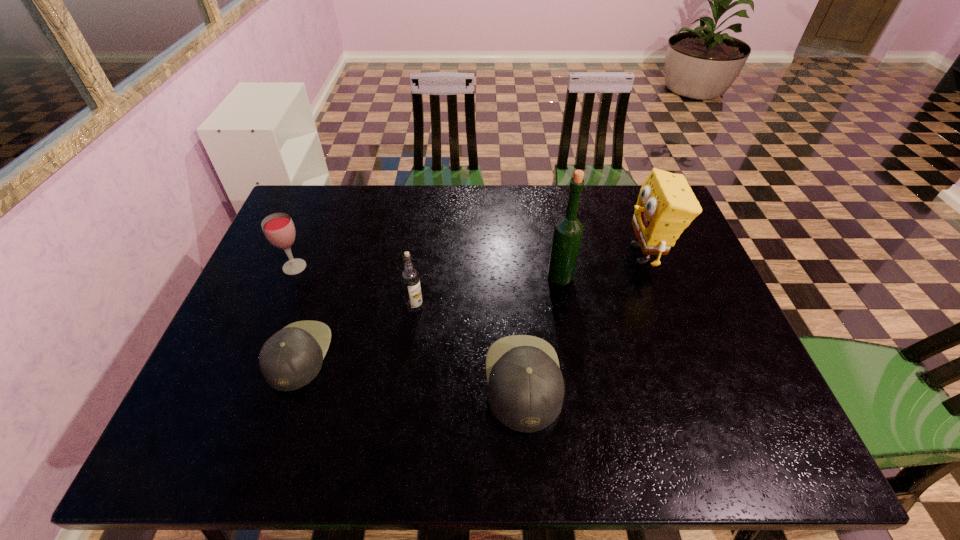
You are a GUI agent. You are given a task and a screenshot of the screen. Output one action in this format:
    pyautogui.click(x=<x>, y=<y>)
    Task: Click on the third shortest object
    
    Given the screenshot: What is the action you would take?
    pyautogui.click(x=278, y=228)

You are a GUI agent. You are given a task and a screenshot of the screen. Output one action in this format:
    pyautogui.click(x=<x>, y=<y>)
    Task: Click on the blank area located on the brim of the left cap
    The height and width of the screenshot is (540, 960).
    Given the screenshot: What is the action you would take?
    pyautogui.click(x=390, y=355)

Find the location of a particular element. The image size is (960, 540). free space located 0.050m on the brim of the right cap is located at coordinates (584, 381).

Where is `vacant area situated 0.380m on the back of the second object from right to left`? The width and height of the screenshot is (960, 540). vacant area situated 0.380m on the back of the second object from right to left is located at coordinates (545, 191).

Where is `free point located on the label of the third nearest object`? free point located on the label of the third nearest object is located at coordinates (404, 393).

In order to click on free space located on the face of the sponge in this screenshot , I will do `click(556, 255)`.

I want to click on blank space located 0.350m on the face of the sponge, so click(502, 255).

You are a GUI agent. You are given a task and a screenshot of the screen. Output one action in this format:
    pyautogui.click(x=<x>, y=<y>)
    Task: Click on the vacant space located on the face of the sponge
    
    Given the screenshot: What is the action you would take?
    pyautogui.click(x=596, y=255)

What are the coordinates of `vacant area situated on the back of the wineglass` in the screenshot? It's located at (316, 215).

Where is `cap situated at the left edge`? cap situated at the left edge is located at coordinates (290, 359).